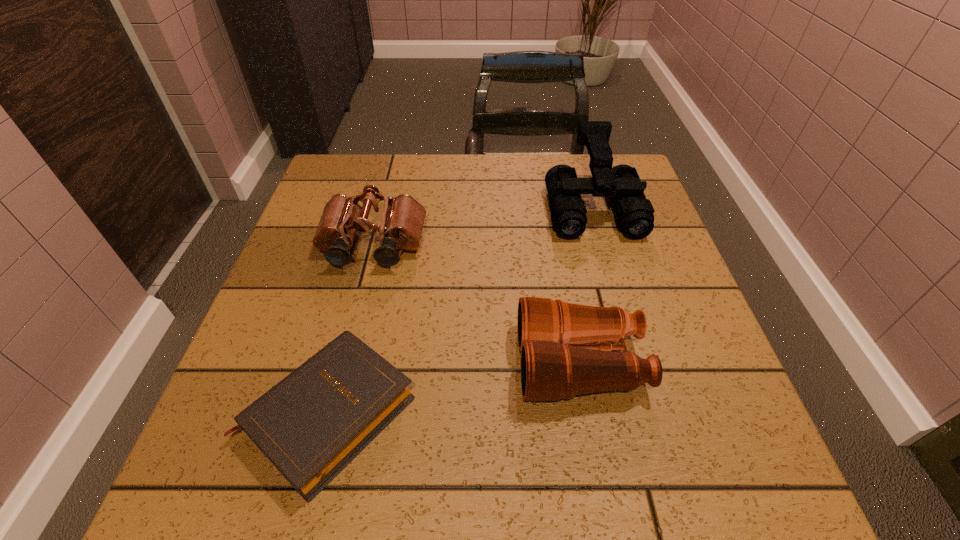
Find the location of a particular element. The image size is (960, 540). vacant space at the near right corner of the desktop is located at coordinates (668, 468).

Locate an element on the screen. free space between the leftmost binoculars and the nearest binoculars is located at coordinates (476, 305).

You are a GUI agent. You are given a task and a screenshot of the screen. Output one action in this format:
    pyautogui.click(x=<x>, y=<y>)
    Task: Click on the blank region between the tallest binoculars and the nearest binoculars
    Image resolution: width=960 pixels, height=540 pixels.
    Given the screenshot: What is the action you would take?
    pyautogui.click(x=587, y=285)

I want to click on free space between the leftmost binoculars and the nearest binoculars, so click(x=476, y=305).

This screenshot has height=540, width=960. Find the location of `vacant area that lies between the nearest binoculars and the tallest object`. vacant area that lies between the nearest binoculars and the tallest object is located at coordinates coord(587,285).

Find the location of a particular element. The height and width of the screenshot is (540, 960). empty space that is in between the leftmost binoculars and the shortest object is located at coordinates (350, 329).

The width and height of the screenshot is (960, 540). I want to click on free space between the tallest binoculars and the shortest object, so click(460, 310).

You are a GUI agent. You are given a task and a screenshot of the screen. Output one action in this format:
    pyautogui.click(x=<x>, y=<y>)
    Task: Click on the free spot between the shortest object and the leftmost binoculars
    The height and width of the screenshot is (540, 960).
    Given the screenshot: What is the action you would take?
    pyautogui.click(x=350, y=329)

Find the location of a particular element. The width and height of the screenshot is (960, 540). blank region between the leftmost binoculars and the shortest object is located at coordinates (350, 329).

Image resolution: width=960 pixels, height=540 pixels. I want to click on empty location between the tallest object and the leftmost binoculars, so click(483, 226).